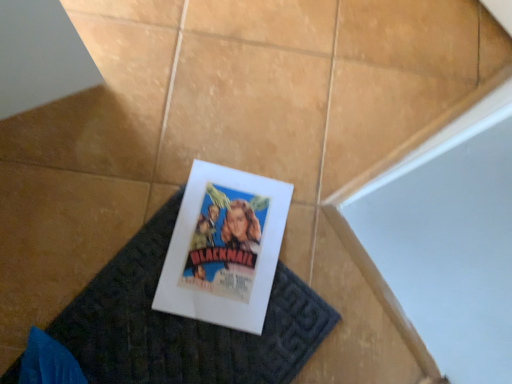
Question: Considering the relative positions of matte paper poster at center and dark gray textured doormat at center in the image provided, is matte paper poster at center to the right of dark gray textured doormat at center from the viewer's perspective?

Choices:
 (A) yes
 (B) no

Answer: (A)

Question: Considering the relative sizes of matte paper poster at center and dark gray textured doormat at center in the image provided, is matte paper poster at center taller than dark gray textured doormat at center?

Choices:
 (A) no
 (B) yes

Answer: (B)

Question: From the image's perspective, is matte paper poster at center below dark gray textured doormat at center?

Choices:
 (A) no
 (B) yes

Answer: (A)

Question: Is dark gray textured doormat at center surrounded by matte paper poster at center?

Choices:
 (A) no
 (B) yes

Answer: (A)

Question: Is matte paper poster at center wider than dark gray textured doormat at center?

Choices:
 (A) no
 (B) yes

Answer: (A)

Question: Does matte paper poster at center appear on the left side of dark gray textured doormat at center?

Choices:
 (A) no
 (B) yes

Answer: (A)

Question: Is dark gray textured doormat at center positioned beyond the bounds of matte paper poster at center?

Choices:
 (A) no
 (B) yes

Answer: (B)

Question: Is dark gray textured doormat at center behind matte paper poster at center?

Choices:
 (A) yes
 (B) no

Answer: (B)

Question: Is dark gray textured doormat at center turned away from matte paper poster at center?

Choices:
 (A) no
 (B) yes

Answer: (A)

Question: Is dark gray textured doormat at center at the left side of matte paper poster at center?

Choices:
 (A) yes
 (B) no

Answer: (A)

Question: Considering the relative positions of dark gray textured doormat at center and matte paper poster at center in the image provided, is dark gray textured doormat at center in front of matte paper poster at center?

Choices:
 (A) no
 (B) yes

Answer: (B)

Question: Does dark gray textured doormat at center appear on the right side of matte paper poster at center?

Choices:
 (A) no
 (B) yes

Answer: (A)

Question: Is dark gray textured doormat at center taller or shorter than matte paper poster at center?

Choices:
 (A) tall
 (B) short

Answer: (B)